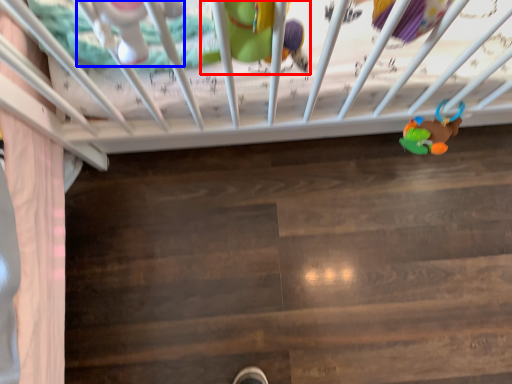
Question: Which object is closer to the camera taking this photo, toy (highlighted by a red box) or toy (highlighted by a blue box)?

Choices:
 (A) toy
 (B) toy

Answer: (B)